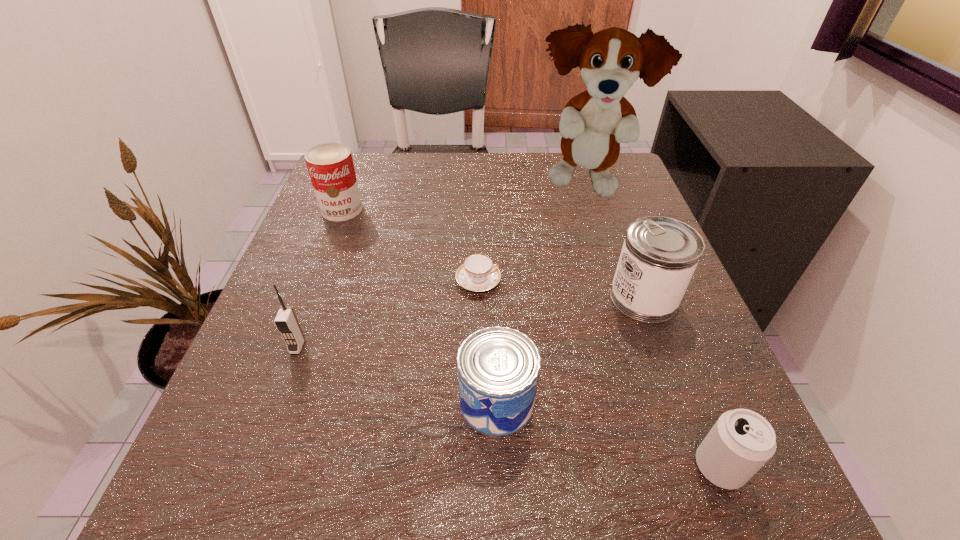
Where is `can present at the left edge`? The image size is (960, 540). can present at the left edge is located at coordinates (330, 165).

Identify the location of cellular telephone that is at the left edge. The width and height of the screenshot is (960, 540). click(x=286, y=321).

This screenshot has height=540, width=960. Find the location of `puppy that is at the right edge`. puppy that is at the right edge is located at coordinates (593, 123).

At what (x,y) coordinates should I click in order to perform the action: click on object situated at the far left corner. Please return your answer as a coordinate pair (x, y). Looking at the image, I should click on (330, 165).

The width and height of the screenshot is (960, 540). What are the coordinates of `object present at the far right corner` in the screenshot? It's located at coord(593,123).

Where is `object present at the near right corner`? object present at the near right corner is located at coordinates (741, 441).

I want to click on vacant space at the far edge of the desktop, so click(422, 181).

At what (x,y) coordinates should I click in order to perform the action: click on blank space at the near edge of the desktop. Please return your answer as a coordinate pair (x, y). Looking at the image, I should click on (566, 510).

Locate an element on the screen. This screenshot has height=540, width=960. vacant space at the left edge is located at coordinates (357, 232).

The width and height of the screenshot is (960, 540). I want to click on vacant area at the right edge, so click(x=603, y=320).